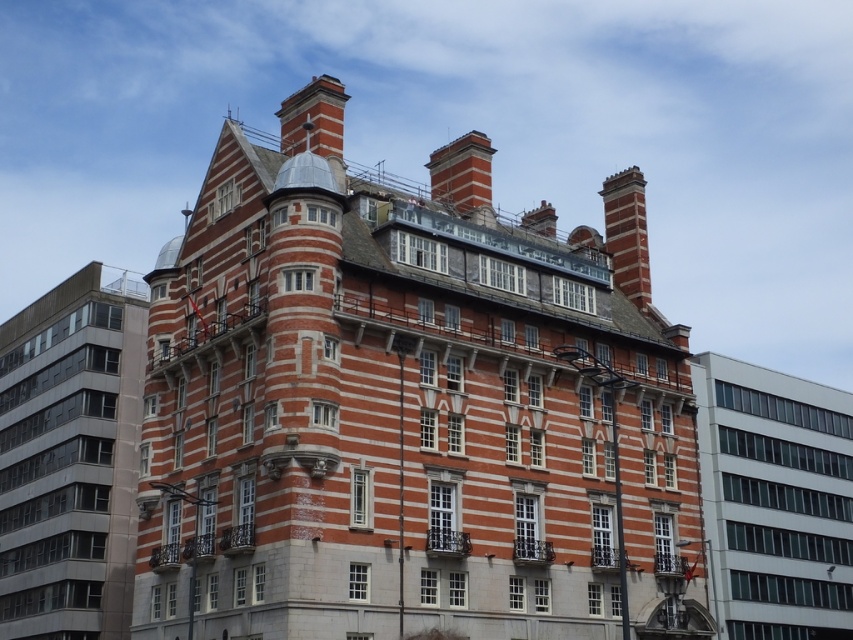
Does red brick chimney at upper right appear under red brick chimney at upper center?

Indeed, red brick chimney at upper right is positioned under red brick chimney at upper center.

Who is more forward, [640,189] or [451,161]?

Positioned in front is point [451,161].

Who is more forward, (612, 177) or (490, 168)?

Point (490, 168) is in front.

You are a GUI agent. You are given a task and a screenshot of the screen. Output one action in this format:
    pyautogui.click(x=<x>, y=<y>)
    Task: Click on the red brick chimney at upper right
    
    Given the screenshot: What is the action you would take?
    point(627,234)

Does red brick building at center appear over red brick chimney at upper center?

Incorrect, red brick building at center is not positioned above red brick chimney at upper center.

Between point (310, 602) and point (457, 195), which one is positioned behind?

Point (457, 195)

Find the location of a particular element. The height and width of the screenshot is (640, 853). red brick building at center is located at coordinates click(x=402, y=417).

Does red brick building at center lie in front of red brick chimney at upper right?

Yes, red brick building at center is closer to the viewer.

Who is more distant from viewer, [260,625] or [619,198]?

Point [619,198]

I want to click on red brick building at center, so click(x=402, y=417).